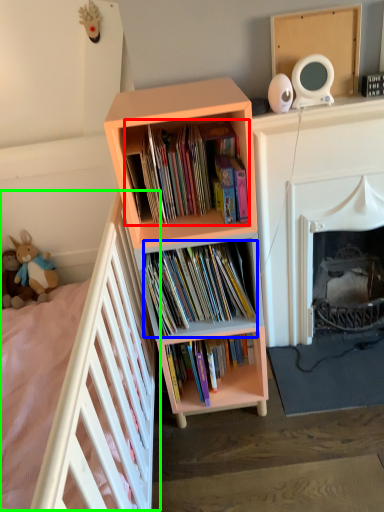
Question: Considering the real-world distances, which object is closest to book (highlighted by a red box)? book (highlighted by a blue box) or bed (highlighted by a green box).

Choices:
 (A) book
 (B) bed

Answer: (A)